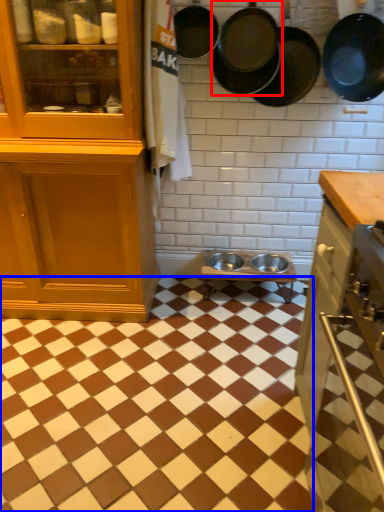
Question: Which object appears closest to the camera in this image, frying pan (highlighted by a red box) or square (highlighted by a blue box)?

Choices:
 (A) frying pan
 (B) square

Answer: (B)